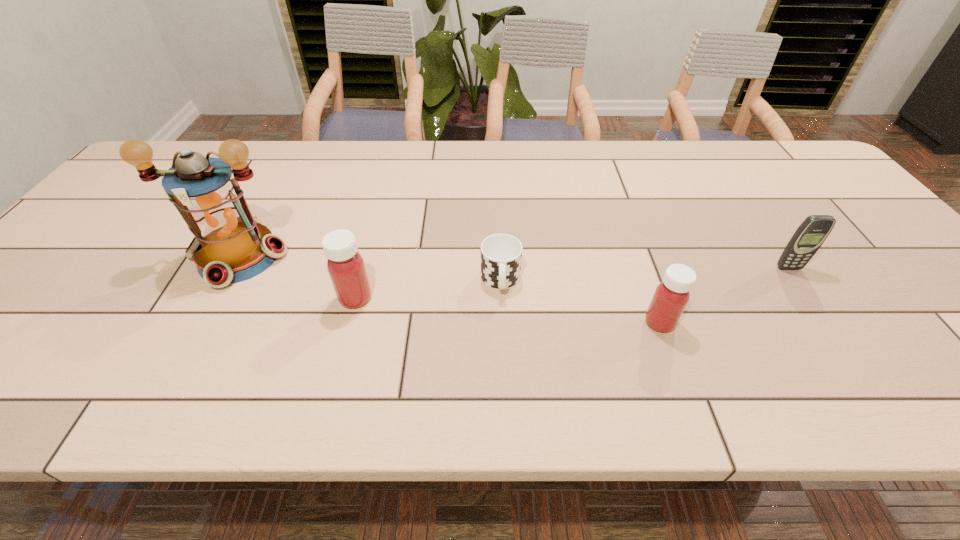
Where is `vacant space that satisfies the following two spatial constraints: 1. on the front-facing side of the second object from left to right; 2. on the left side of the leftmost object`? This screenshot has width=960, height=540. vacant space that satisfies the following two spatial constraints: 1. on the front-facing side of the second object from left to right; 2. on the left side of the leftmost object is located at coordinates (216, 298).

Find the location of `blank space that satisfies the following two spatial constraints: 1. on the front-facing side of the leftmost object; 2. on the left side of the left medicine`. blank space that satisfies the following two spatial constraints: 1. on the front-facing side of the leftmost object; 2. on the left side of the left medicine is located at coordinates (216, 298).